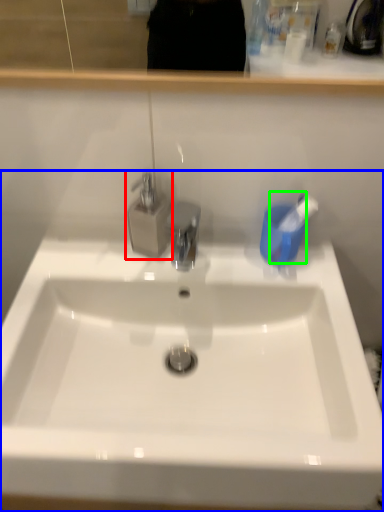
Question: Which object is the farthest from tap (highlighted by a red box)? Choose among these: sink (highlighted by a blue box) or toothbrush (highlighted by a green box).

Choices:
 (A) sink
 (B) toothbrush

Answer: (A)